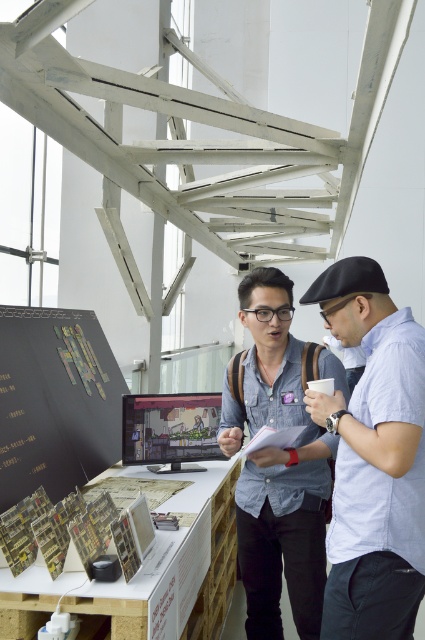
Does light blue shirt at center have a lesser height compared to denim shirt at center?

Yes, light blue shirt at center is shorter than denim shirt at center.

Does light blue shirt at center have a smaller size compared to denim shirt at center?

Indeed, light blue shirt at center has a smaller size compared to denim shirt at center.

Who is more forward, (388, 484) or (320, 444)?

Point (388, 484)

The width and height of the screenshot is (425, 640). Identify the location of light blue shirt at center. (373, 458).

Can you confirm if light blue shirt at center is positioned below matte black monitor at center?

Actually, light blue shirt at center is above matte black monitor at center.

Does light blue shirt at center have a greater width compared to matte black monitor at center?

Incorrect, light blue shirt at center's width does not surpass matte black monitor at center's.

Who is more distant from viewer, (380,273) or (163,429)?

The point (163,429) is behind.

Locate an element on the screen. light blue shirt at center is located at coordinates 373,458.

Which is in front, point (288, 339) or point (209, 404)?

Point (288, 339)

Image resolution: width=425 pixels, height=640 pixels. Find the location of `denim shirt at center`. denim shirt at center is located at coordinates (278, 460).